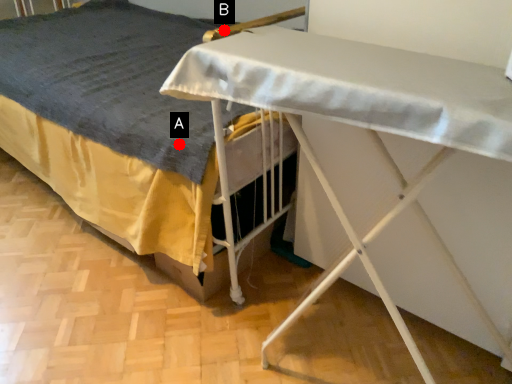
Question: Two points are circled on the image, labeled by A and B beside each circle. Among these points, which one is nearest to the camera?

Choices:
 (A) A is closer
 (B) B is closer

Answer: (B)